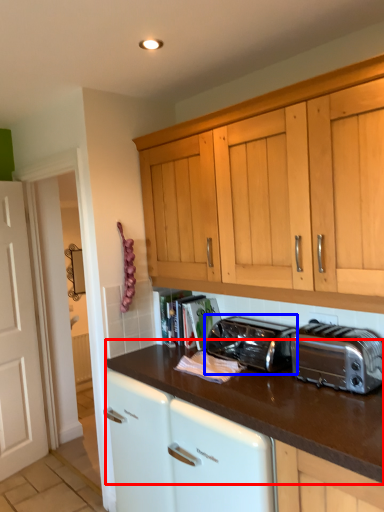
Question: Which object appears farthest to the camera in this image, countertop (highlighted by a red box) or toaster (highlighted by a blue box)?

Choices:
 (A) countertop
 (B) toaster

Answer: (B)